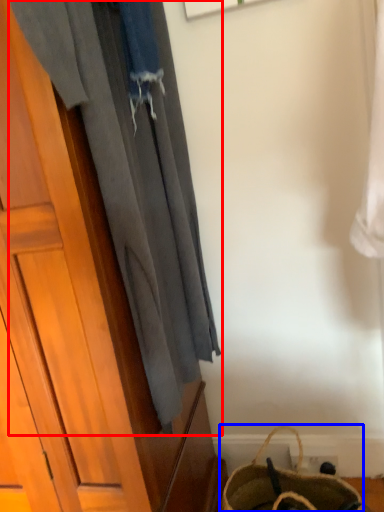
Question: Among these objects, which one is farthest to the camera, curtain (highlighted by a red box) or handbag (highlighted by a blue box)?

Choices:
 (A) curtain
 (B) handbag

Answer: (B)